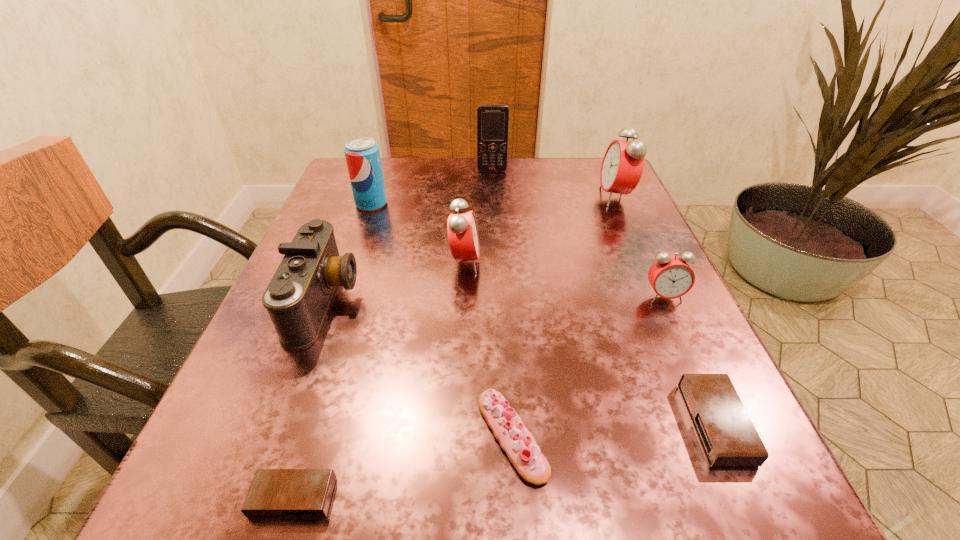
Where is `the third shortest object`? This screenshot has height=540, width=960. the third shortest object is located at coordinates point(514,438).

I want to click on the second shortest alarm clock, so click(x=728, y=437).

Identify the location of the right black alarm clock. This screenshot has height=540, width=960. (728, 437).

At what (x,y) coordinates should I click in order to perform the action: click on the leftmost alarm clock. Please return your answer as a coordinate pair (x, y). The height and width of the screenshot is (540, 960). Looking at the image, I should click on (274, 493).

Locate an element on the screen. This screenshot has width=960, height=540. the smaller black alarm clock is located at coordinates (274, 493).

Identify the location of vacant space situated 0.370m on the screen of the orange cellular telephone. (496, 267).

The width and height of the screenshot is (960, 540). I want to click on vacant position located 0.090m on the front-facing side of the farthest red alarm clock, so click(x=561, y=197).

Locate an element on the screen. free space located 0.290m on the front-facing side of the farthest red alarm clock is located at coordinates (473, 197).

What are the coordinates of `vacant space located on the front-facing side of the farthest red alarm clock` in the screenshot? It's located at (547, 197).

The image size is (960, 540). What are the coordinates of `free spot located on the right of the soda can` in the screenshot? It's located at tap(512, 204).